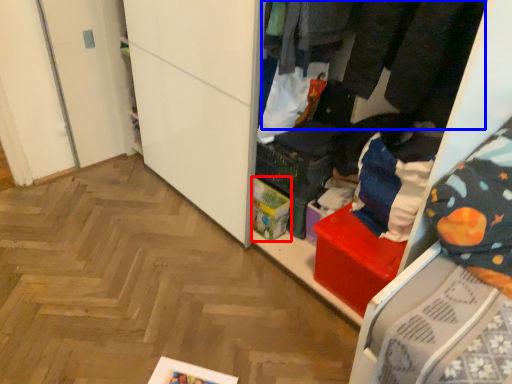
Question: Which point is further to the camera, storage box (highlighted by a red box) or clothing (highlighted by a blue box)?

Choices:
 (A) storage box
 (B) clothing

Answer: (A)